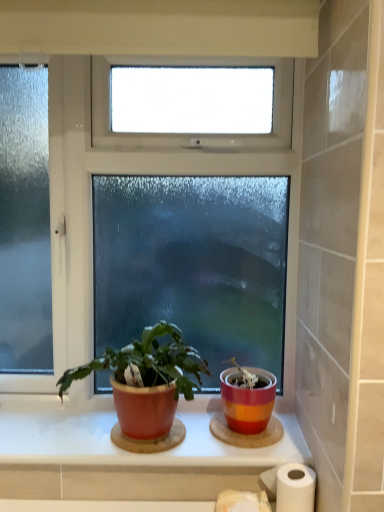
Question: From the image's perspective, is matte ceramic window sill at center located beneath matte red pot at center?

Choices:
 (A) yes
 (B) no

Answer: (A)

Question: Does matte ceramic window sill at center have a lesser width compared to matte red pot at center?

Choices:
 (A) no
 (B) yes

Answer: (B)

Question: Is matte ceramic window sill at center positioned with its back to matte red pot at center?

Choices:
 (A) yes
 (B) no

Answer: (B)

Question: Can you confirm if matte ceramic window sill at center is bigger than matte red pot at center?

Choices:
 (A) yes
 (B) no

Answer: (B)

Question: Considering the relative sizes of matte ceramic window sill at center and matte red pot at center in the image provided, is matte ceramic window sill at center wider than matte red pot at center?

Choices:
 (A) no
 (B) yes

Answer: (A)

Question: From the image's perspective, is matte red pot at center above or below matte ceramic window sill at center?

Choices:
 (A) above
 (B) below

Answer: (A)

Question: From their relative heights in the image, would you say matte red pot at center is taller or shorter than matte ceramic window sill at center?

Choices:
 (A) short
 (B) tall

Answer: (B)

Question: Do you think matte red pot at center is within matte ceramic window sill at center, or outside of it?

Choices:
 (A) outside
 (B) inside

Answer: (A)

Question: From a real-world perspective, is matte red pot at center physically located above or below matte ceramic window sill at center?

Choices:
 (A) above
 (B) below

Answer: (A)

Question: Based on their positions, is matte ceramic window sill at center located to the left or right of matte red pot at center?

Choices:
 (A) right
 (B) left

Answer: (A)

Question: In terms of height, does matte ceramic window sill at center look taller or shorter compared to matte red pot at center?

Choices:
 (A) tall
 (B) short

Answer: (B)

Question: From the image's perspective, relative to matte red pot at center, is matte ceramic window sill at center above or below?

Choices:
 (A) below
 (B) above

Answer: (A)

Question: Relative to matte red pot at center, is matte ceramic window sill at center in front or behind?

Choices:
 (A) behind
 (B) front

Answer: (A)

Question: Is white matte toilet paper at lower center to the left or to the right of white paper at lower right in the image?

Choices:
 (A) left
 (B) right

Answer: (A)

Question: In terms of width, does white matte toilet paper at lower center look wider or thinner when compared to white paper at lower right?

Choices:
 (A) wide
 (B) thin

Answer: (A)